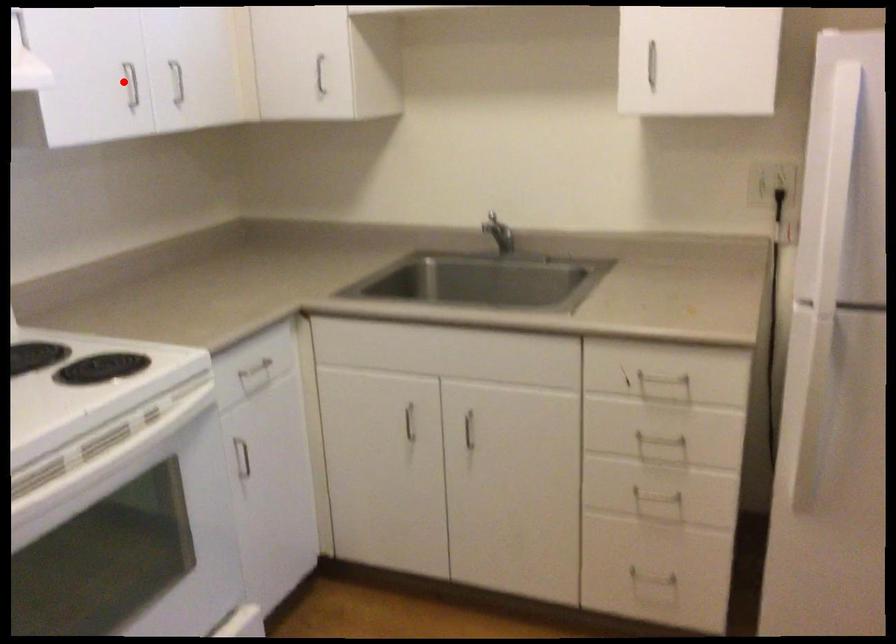
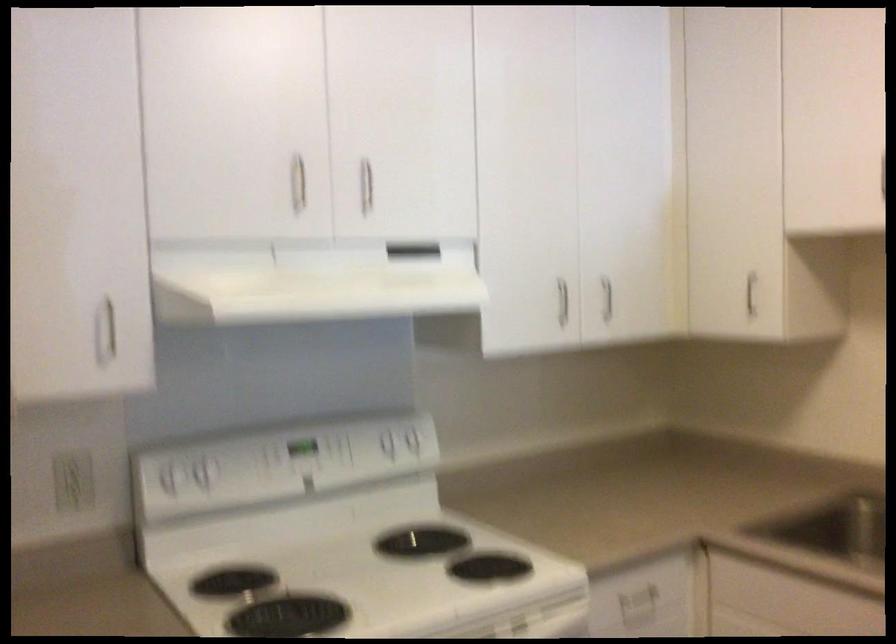
Locate, in the second image, the point that corresponds to the highlighted location in the first image.

(562, 301)